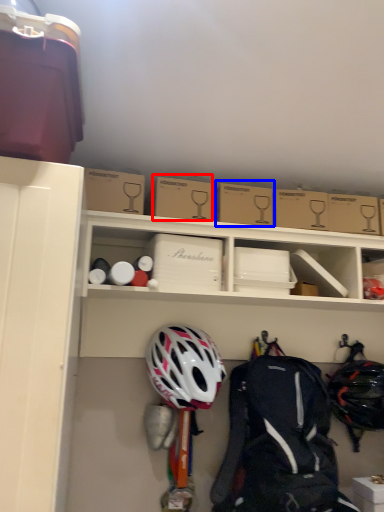
Question: Among these objects, which one is nearest to the camera, cardboard box (highlighted by a red box) or cardboard box (highlighted by a blue box)?

Choices:
 (A) cardboard box
 (B) cardboard box

Answer: (A)